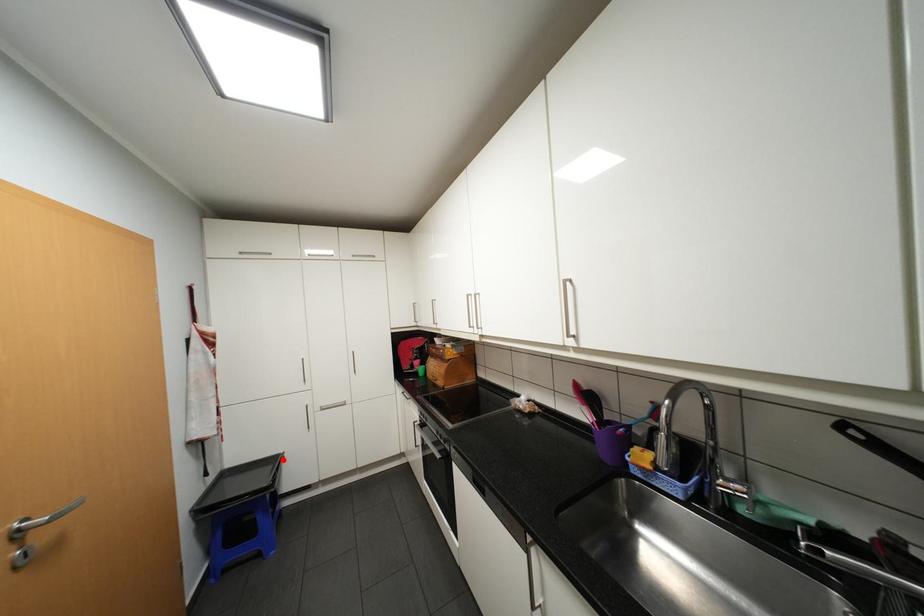
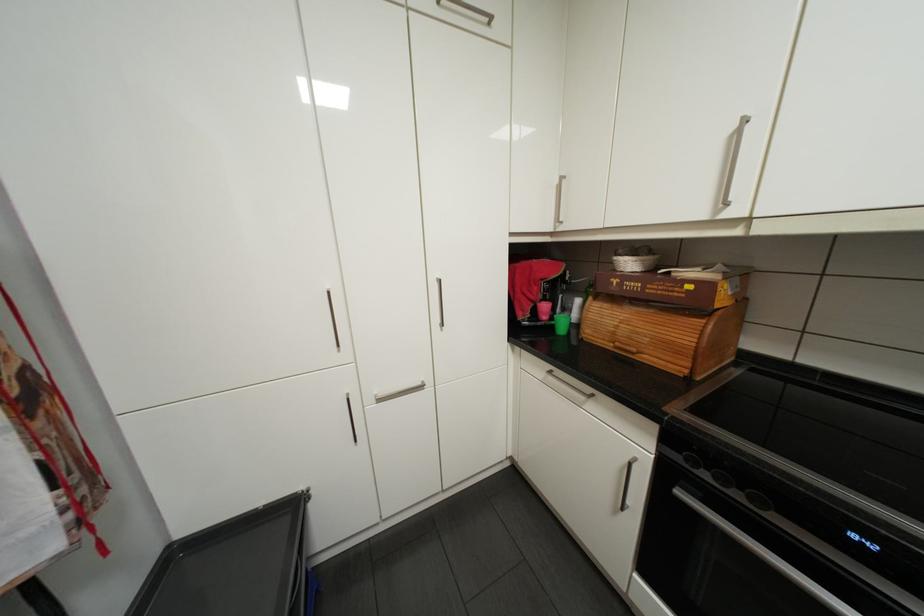
Find the pixel in the second image that matches the highlighted location in the first image.

(300, 507)